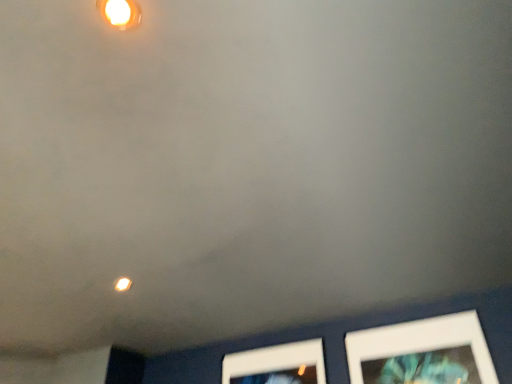
Question: Should I look upward or downward to see matte white light fixture at upper center?

Choices:
 (A) down
 (B) up

Answer: (B)

Question: From the image's perspective, is matte yellow light at upper left below white matte picture frame at lower right?

Choices:
 (A) no
 (B) yes

Answer: (A)

Question: From a real-world perspective, does matte yellow light at upper left stand above white matte picture frame at lower right?

Choices:
 (A) no
 (B) yes

Answer: (B)

Question: Is matte yellow light at upper left with white matte picture frame at lower right?

Choices:
 (A) yes
 (B) no

Answer: (B)

Question: Is the depth of matte yellow light at upper left greater than that of white matte picture frame at lower right?

Choices:
 (A) yes
 (B) no

Answer: (A)

Question: Considering the relative sizes of matte yellow light at upper left and white matte picture frame at lower right in the image provided, is matte yellow light at upper left taller than white matte picture frame at lower right?

Choices:
 (A) no
 (B) yes

Answer: (A)

Question: Is matte yellow light at upper left facing away from white matte picture frame at lower right?

Choices:
 (A) yes
 (B) no

Answer: (B)

Question: Can you confirm if white matte picture frame at lower right is positioned to the left of matte white light fixture at upper center?

Choices:
 (A) no
 (B) yes

Answer: (A)

Question: Does white matte picture frame at lower right have a larger size compared to matte white light fixture at upper center?

Choices:
 (A) yes
 (B) no

Answer: (A)

Question: Is white matte picture frame at lower right next to matte white light fixture at upper center?

Choices:
 (A) yes
 (B) no

Answer: (B)

Question: Can you confirm if white matte picture frame at lower right is smaller than matte white light fixture at upper center?

Choices:
 (A) no
 (B) yes

Answer: (A)

Question: From a real-world perspective, is white matte picture frame at lower right positioned over matte white light fixture at upper center based on gravity?

Choices:
 (A) yes
 (B) no

Answer: (B)

Question: Is white matte picture frame at lower right facing towards matte white light fixture at upper center?

Choices:
 (A) no
 (B) yes

Answer: (B)

Question: Is matte yellow light at upper left located outside matte white light fixture at upper center?

Choices:
 (A) yes
 (B) no

Answer: (A)